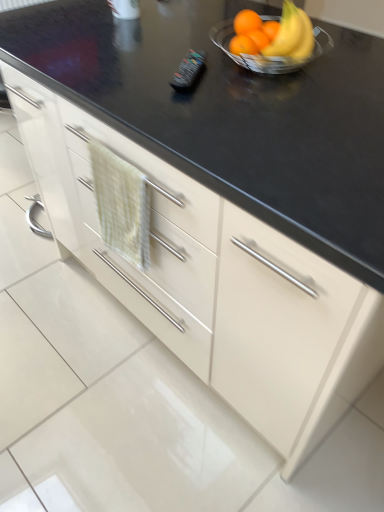
Question: Considering the relative sizes of black plastic remote control at center and orange matte at upper right in the image provided, is black plastic remote control at center bigger than orange matte at upper right?

Choices:
 (A) no
 (B) yes

Answer: (A)

Question: Can orange matte at upper right be found inside black plastic remote control at center?

Choices:
 (A) no
 (B) yes

Answer: (A)

Question: Could you tell me if black plastic remote control at center is turned towards orange matte at upper right?

Choices:
 (A) no
 (B) yes

Answer: (A)

Question: Is black plastic remote control at center wider than orange matte at upper right?

Choices:
 (A) no
 (B) yes

Answer: (A)

Question: From a real-world perspective, is black plastic remote control at center located higher than orange matte at upper right?

Choices:
 (A) yes
 (B) no

Answer: (B)

Question: Is clear glass bowl at upper right in front of or behind black plastic remote control at center in the image?

Choices:
 (A) behind
 (B) front

Answer: (B)

Question: Considering the positions of clear glass bowl at upper right and black plastic remote control at center in the image, is clear glass bowl at upper right wider or thinner than black plastic remote control at center?

Choices:
 (A) wide
 (B) thin

Answer: (A)

Question: Would you say clear glass bowl at upper right is to the left or to the right of black plastic remote control at center in the picture?

Choices:
 (A) right
 (B) left

Answer: (A)

Question: Is point (218, 38) positioned closer to the camera than point (190, 65)?

Choices:
 (A) farther
 (B) closer

Answer: (A)

Question: Does point (241, 24) appear closer or farther from the camera than point (249, 19)?

Choices:
 (A) farther
 (B) closer

Answer: (A)

Question: From the image's perspective, is shiny metallic bowl at upper right located above or below orange matte at upper right?

Choices:
 (A) below
 (B) above

Answer: (A)

Question: Is shiny metallic bowl at upper right inside the boundaries of orange matte at upper right, or outside?

Choices:
 (A) inside
 (B) outside

Answer: (B)

Question: Based on their sizes in the image, would you say shiny metallic bowl at upper right is bigger or smaller than orange matte at upper right?

Choices:
 (A) small
 (B) big

Answer: (B)

Question: Considering the positions of point (195, 56) and point (132, 210), is point (195, 56) closer or farther from the camera than point (132, 210)?

Choices:
 (A) farther
 (B) closer

Answer: (A)

Question: Considering their positions, is black plastic remote control at center located in front of or behind green textured hand towel at center-left?

Choices:
 (A) front
 (B) behind

Answer: (B)